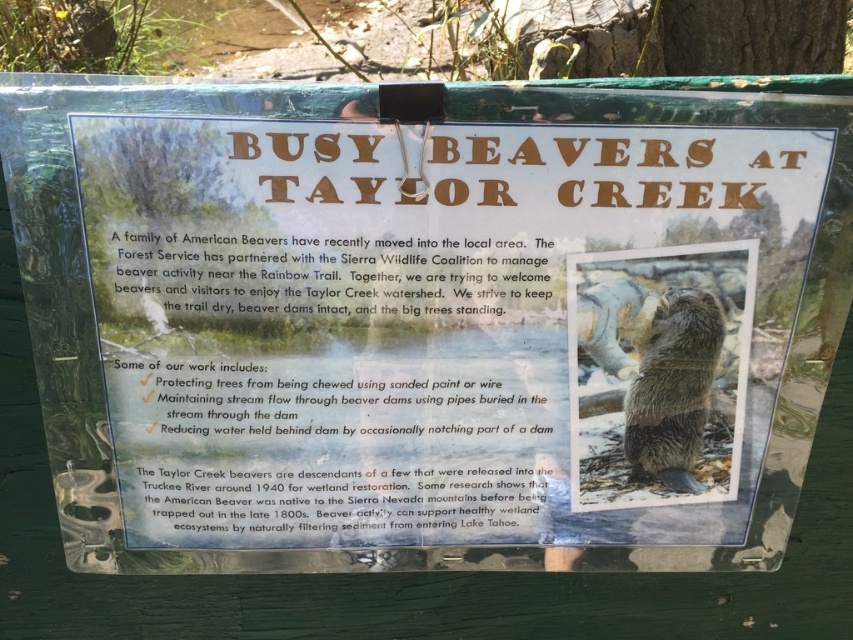
Which is below, fuzzy brown beaver at center or fuzzy brown otter at center?

fuzzy brown otter at center is lower down.

Does point (657, 484) come closer to viewer compared to point (694, 332)?

No, it is behind (694, 332).

Does point (636, 305) come behind point (695, 346)?

No.

Where is `fuzzy brown beaver at center`? This screenshot has height=640, width=853. fuzzy brown beaver at center is located at coordinates (659, 372).